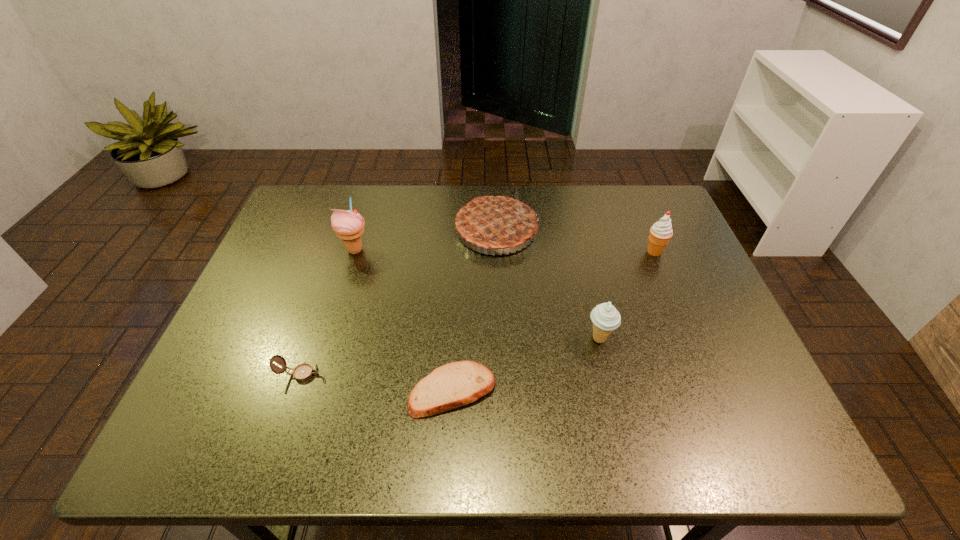
The height and width of the screenshot is (540, 960). Find the location of `pie`. pie is located at coordinates (494, 222).

What are the coordinates of `the leftmost icecream` in the screenshot? It's located at (348, 225).

You are a GUI agent. You are given a task and a screenshot of the screen. Output one action in this format:
    pyautogui.click(x=<x>, y=<y>)
    Task: Click on the rightmost icecream
    The image size is (960, 540).
    Given the screenshot: What is the action you would take?
    pyautogui.click(x=660, y=233)

In order to click on the second icecream from right to left in this screenshot , I will do `click(605, 317)`.

The height and width of the screenshot is (540, 960). I want to click on the fifth object from left to right, so click(605, 317).

Find the location of a particular element. The height and width of the screenshot is (540, 960). compass is located at coordinates (302, 372).

Where is `pita bread`? The height and width of the screenshot is (540, 960). pita bread is located at coordinates (453, 385).

In order to click on free space located 0.370m on the front of the pie in this screenshot , I will do `click(502, 375)`.

Where is `free location located on the front of the leftmost icecream`? This screenshot has width=960, height=540. free location located on the front of the leftmost icecream is located at coordinates (346, 281).

Where is `vacant space located on the left of the rightmost icecream`? Image resolution: width=960 pixels, height=540 pixels. vacant space located on the left of the rightmost icecream is located at coordinates (579, 252).